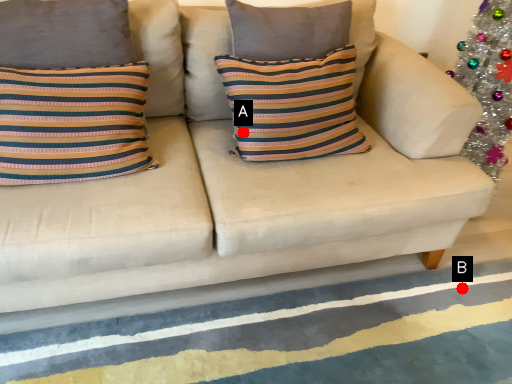
Question: Two points are circled on the image, labeled by A and B beside each circle. Which point is further to the camera?

Choices:
 (A) A is further
 (B) B is further

Answer: (B)